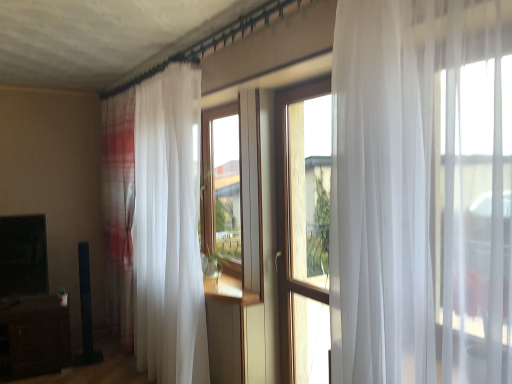
The image size is (512, 384). What are the coordinates of `vacant space to the right of brown wood entertainment center at lower left` in the screenshot? It's located at (94, 365).